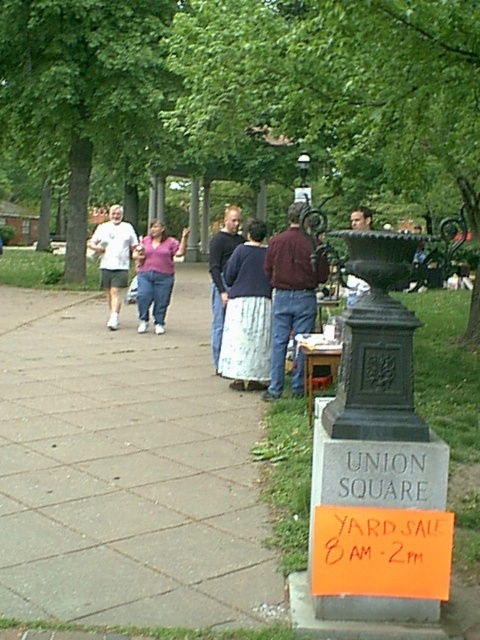
Is gray concrete sidewalk at center further to the viewer compared to orange paper sign at lower right?

Yes.

Does gray concrete sidewalk at center have a greater width compared to orange paper sign at lower right?

Indeed, gray concrete sidewalk at center has a greater width compared to orange paper sign at lower right.

Describe the element at coordinates (127, 468) in the screenshot. I see `gray concrete sidewalk at center` at that location.

Where is `gray concrete sidewalk at center`? gray concrete sidewalk at center is located at coordinates (127, 468).

Is orange paper sign at lower right to the right of dark blue shirt at center from the viewer's perspective?

Yes, orange paper sign at lower right is to the right of dark blue shirt at center.

Does point (417, 596) come behind point (225, 285)?

That is False.

Who is more forward, (x=357, y=547) or (x=214, y=307)?

Point (x=357, y=547)

In order to click on orange paper sign at lower right in this screenshot , I will do `click(382, 552)`.

Can you confirm if gray concrete sidewalk at center is wider than matte white t-shirt at left?

Yes.

Is gray concrete sidewalk at center to the left of matte white t-shirt at left from the viewer's perspective?

In fact, gray concrete sidewalk at center is to the right of matte white t-shirt at left.

Is point (156, 358) less distant than point (124, 252)?

Yes, it is.

Identify the location of gray concrete sidewalk at center. The width and height of the screenshot is (480, 640). (127, 468).